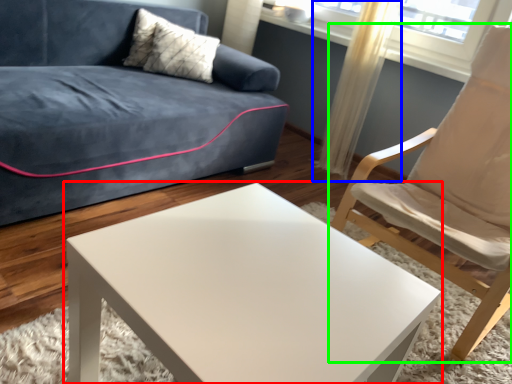
Question: Which is farther away from coffee table (highlighted by a red box)? curtain (highlighted by a blue box) or chair (highlighted by a green box)?

Choices:
 (A) curtain
 (B) chair

Answer: (A)